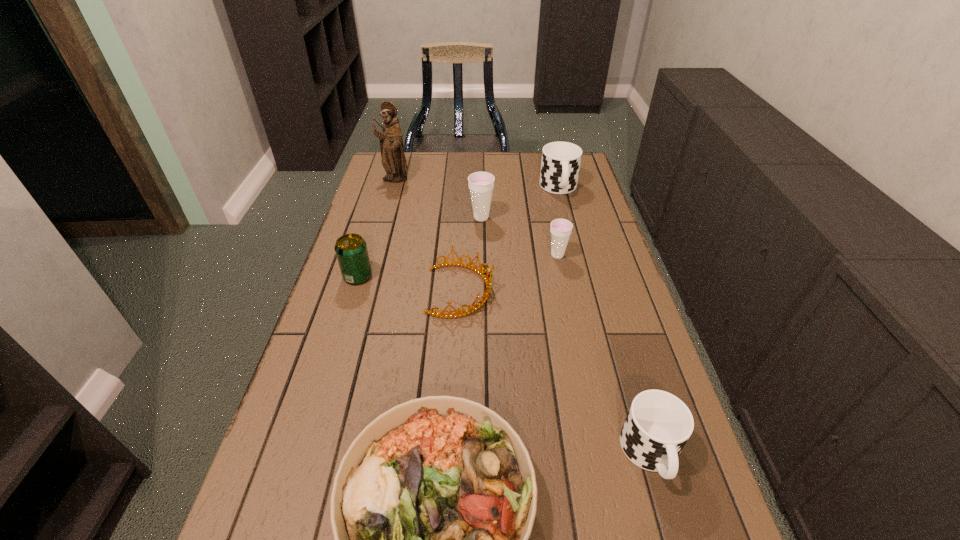
Where is `figurine located in the left edge section of the desktop`? The image size is (960, 540). figurine located in the left edge section of the desktop is located at coordinates (393, 160).

At what (x,y) coordinates should I click in order to perform the action: click on beer can located at the left edge. Please return your answer as a coordinate pair (x, y). The width and height of the screenshot is (960, 540). Looking at the image, I should click on (351, 250).

Image resolution: width=960 pixels, height=540 pixels. What are the coordinates of `object at the far left corner` in the screenshot? It's located at (393, 160).

I want to click on object present at the far right corner, so click(560, 165).

Locate an element on the screen. Image resolution: width=960 pixels, height=540 pixels. vacant space at the far edge of the desktop is located at coordinates (487, 157).

This screenshot has height=540, width=960. What are the coordinates of `vacant space at the left edge of the desktop` in the screenshot? It's located at (360, 205).

You are a GUI agent. You are given a task and a screenshot of the screen. Output one action in this format:
    pyautogui.click(x=<x>, y=<y>)
    Task: Click on the free space at the right edge of the desktop
    
    Given the screenshot: What is the action you would take?
    pos(575,260)

Identify the location of blank region between the tiara and the farthest cup. The image size is (960, 540). (510, 239).

This screenshot has width=960, height=540. Find the location of `vacant space that's between the green beer can and the tallest object`. vacant space that's between the green beer can and the tallest object is located at coordinates [376, 228].

Select which object appears as the seventh closest to the salad plate. Please provide its 2D coordinates. Your answer should be formatted as a tuple, i.e. [(x, y)], where the tuple contains the x and y coordinates of a point satisfying the conditions above.

[(393, 160)]